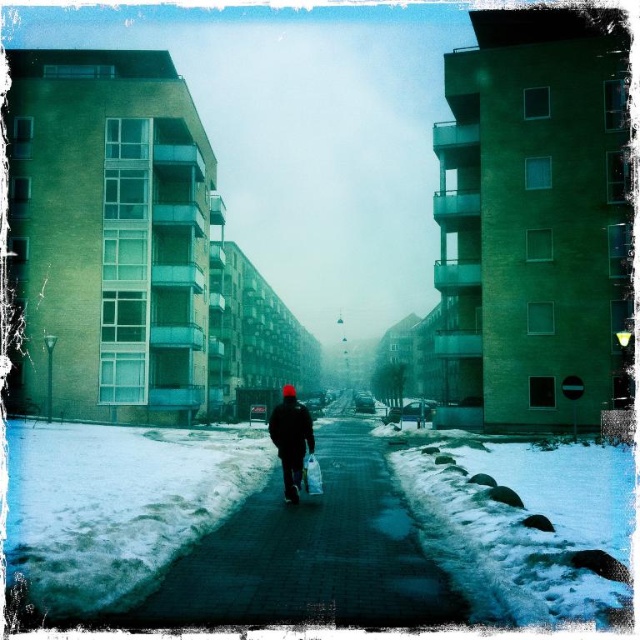
Find the location of a particular element. The width and height of the screenshot is (640, 640). dark matte jacket at center is located at coordinates (291, 440).

Does dark matte jacket at center have a greater height compared to dark blue textured jacket at center?

Yes, dark matte jacket at center is taller than dark blue textured jacket at center.

The height and width of the screenshot is (640, 640). Describe the element at coordinates (291, 440) in the screenshot. I see `dark matte jacket at center` at that location.

Find the location of `dark matte jacket at center`. dark matte jacket at center is located at coordinates (291, 440).

Can you confirm if smooth concrete pavement at center is smaller than dark blue textured jacket at center?

No.

Does smooth concrete pavement at center appear under dark blue textured jacket at center?

Yes.

Does point (268, 541) come in front of point (308, 413)?

Yes, it is in front of point (308, 413).

Identify the location of smooth concrete pavement at center. (308, 554).

Can you confirm if smooth concrete pavement at center is bigger than dark matte jacket at center?

No.

Does smooth concrete pavement at center have a lesser width compared to dark matte jacket at center?

Incorrect, smooth concrete pavement at center's width is not less than dark matte jacket at center's.

Find the location of a particular element. Image resolution: width=640 pixels, height=640 pixels. smooth concrete pavement at center is located at coordinates (308, 554).